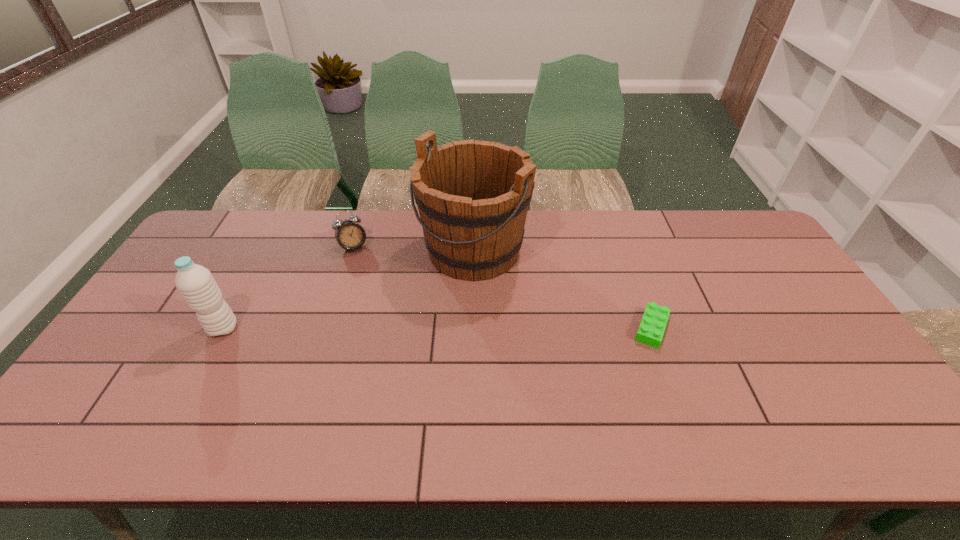
Identify the location of unoccupied position between the tallest object and the second tallest object. Image resolution: width=960 pixels, height=540 pixels. (348, 289).

You are a GUI agent. You are given a task and a screenshot of the screen. Output one action in this format:
    pyautogui.click(x=<x>, y=<y>)
    Task: Click on the empty space between the rightmost object and the third shortest object
    
    Given the screenshot: What is the action you would take?
    pyautogui.click(x=437, y=328)

Find the location of a particular element. vacant space that is in between the third tallest object and the shortest object is located at coordinates (502, 288).

The width and height of the screenshot is (960, 540). I want to click on vacant space that's between the tallest object and the rightmost object, so click(562, 289).

In order to click on vacant area that lies between the third shortest object and the alarm clock in this screenshot , I will do `click(288, 288)`.

This screenshot has width=960, height=540. Find the location of `object that is the second nearest to the second tallest object`. object that is the second nearest to the second tallest object is located at coordinates (473, 196).

Choose which object is the nearest neighbor to the alarm clock. Please provide its 2D coordinates. Your answer should be formatted as a tuple, i.e. [(x, y)], where the tuple contains the x and y coordinates of a point satisfying the conditions above.

[(473, 196)]

Identify the location of free region that satisfies the following two spatial constraints: 1. on the front side of the water bottle; 2. on the right side of the rightmost object. (223, 328).

Find the location of a particular element. vacant space that satisfies the following two spatial constraints: 1. on the front side of the rightmost object; 2. on the right side of the wine bucket is located at coordinates (471, 328).

Identify the location of free spot that satisfies the following two spatial constraints: 1. on the front side of the second shortest object; 2. on the left side of the shortest object. (327, 328).